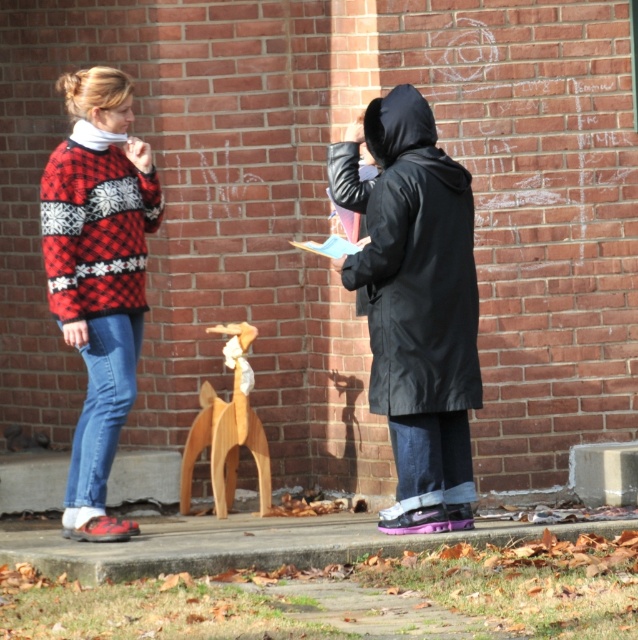
You are a fashion designer analyzing the outfits in the image. Which of the two outfits, the red and white knitted sweater at left or the black matte coat at center, appears narrower when viewed from the front?

The red and white knitted sweater at left appears narrower compared to the black matte coat at center as it has a lesser width.

You are a fashion designer observing the scene. You need to decide which item is wider between the red and white knitted sweater at left and the wooden horse at center. Which one is wider?

The red and white knitted sweater at left is wider than the wooden horse at center according to the description.